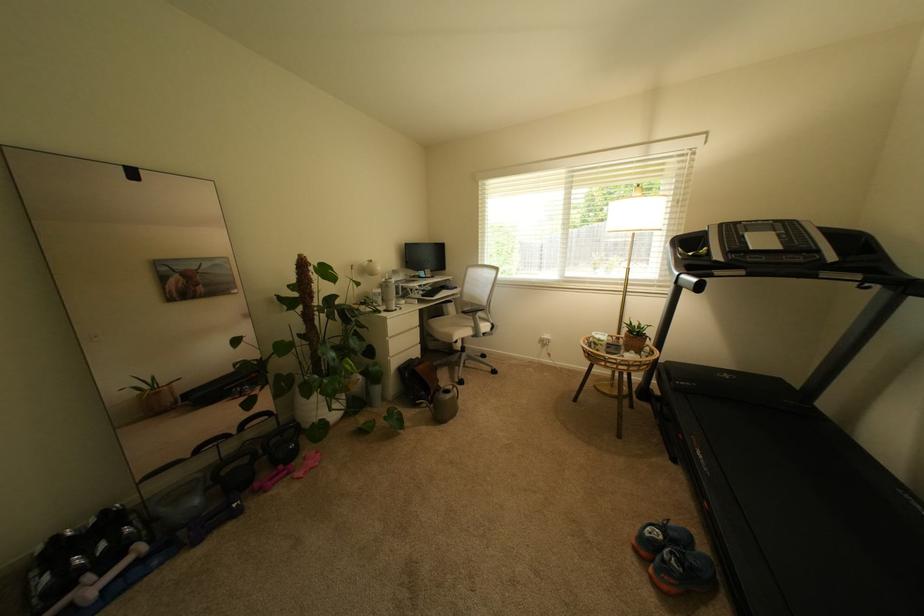
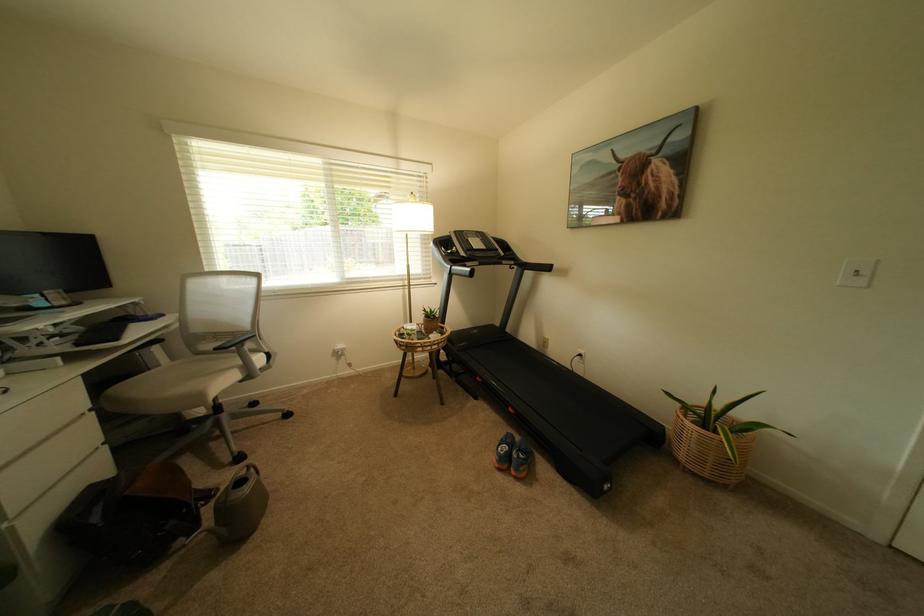
Locate, in the second image, the point that corresponds to point 788,249 in the first image.

(493, 249)